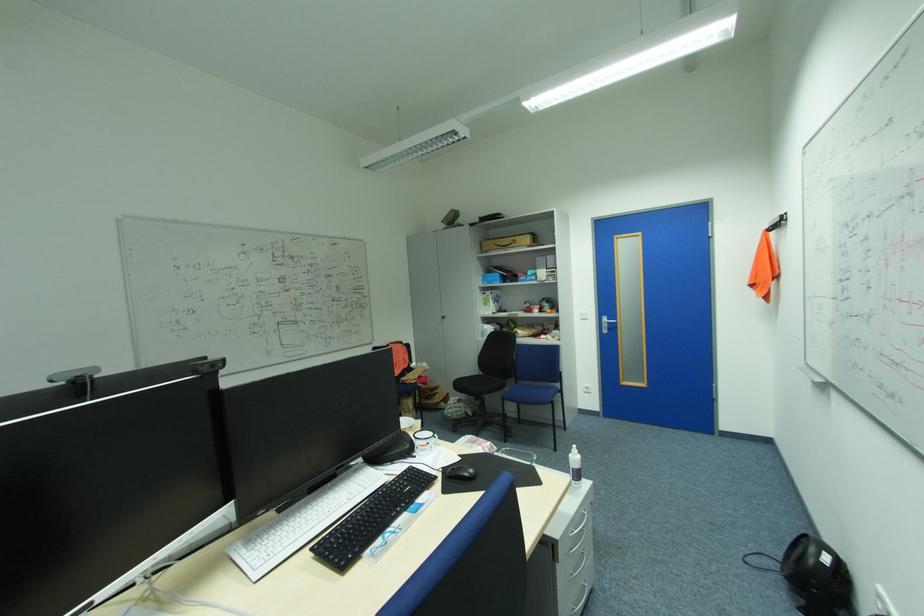
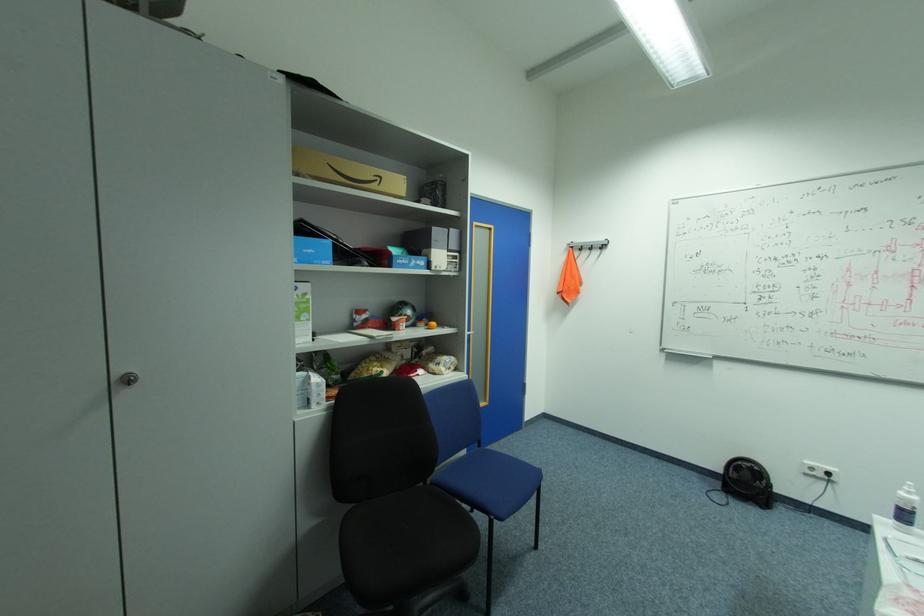
Locate, in the second image, the point that corresponds to point 450,317 in the first image.

(137, 379)